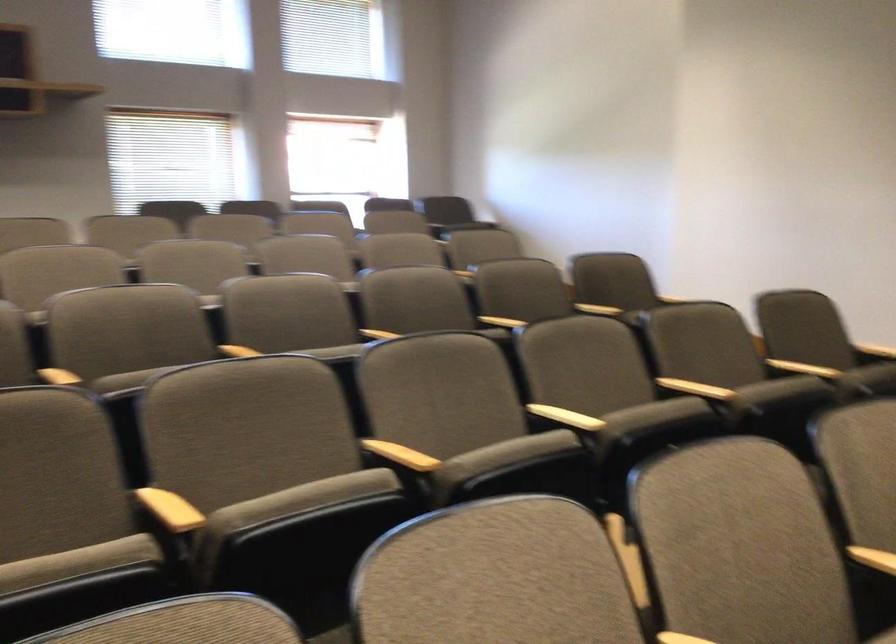
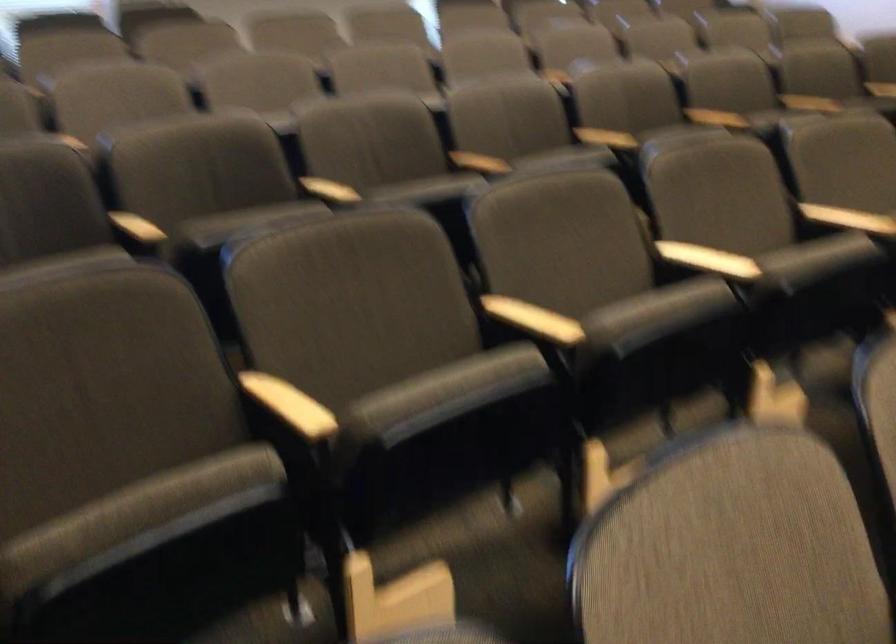
Question: What movement of the cameraman would produce the second image?

Choices:
 (A) Left
 (B) Right
 (C) Forward
 (D) Backward

Answer: (D)